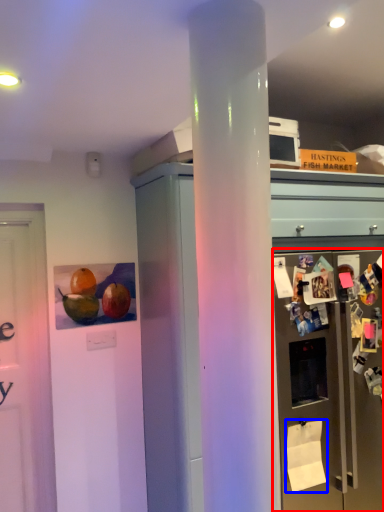
Question: Which of the following is the farthest to the observer, refrigerator (highlighted by a red box) or toilet paper (highlighted by a blue box)?

Choices:
 (A) refrigerator
 (B) toilet paper

Answer: (B)